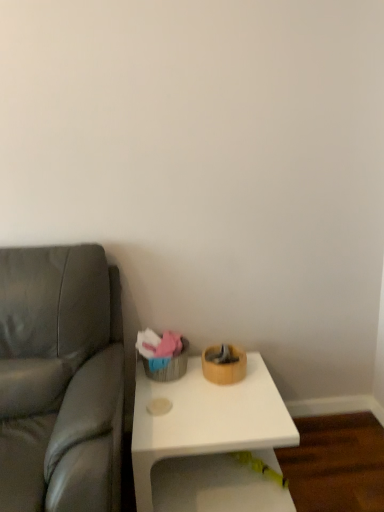
Image resolution: width=384 pixels, height=512 pixels. I want to click on vacant area that lies to the right of white matte table at center, so click(x=329, y=459).